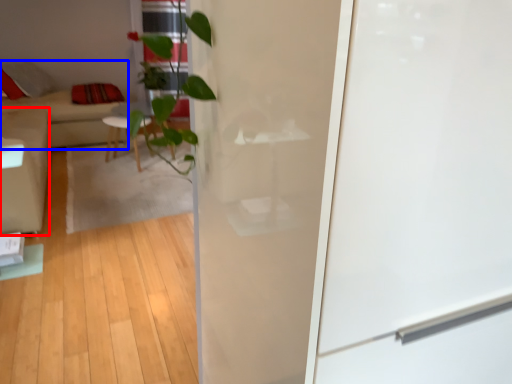
Question: Which object appears farthest to the camera in this image, armchair (highlighted by a red box) or couch (highlighted by a blue box)?

Choices:
 (A) armchair
 (B) couch

Answer: (B)